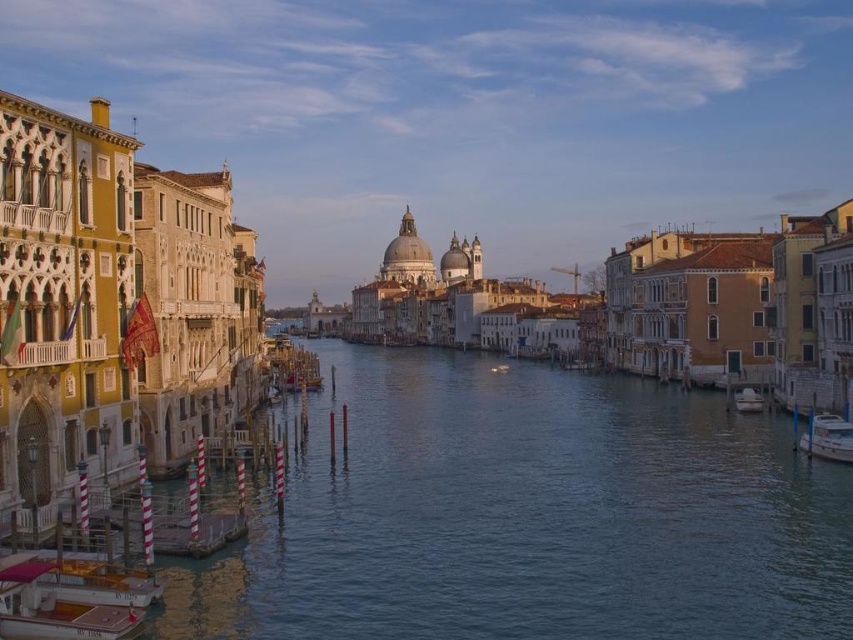
Question: Is wooden polished boat at lower left above white glossy boat at right?

Choices:
 (A) no
 (B) yes

Answer: (A)

Question: Which of the following is the closest to the observer?

Choices:
 (A) (821, 417)
 (B) (36, 637)

Answer: (B)

Question: Where is wooden polished boat at lower left located in relation to white glossy boat at lower right in the image?

Choices:
 (A) right
 (B) left

Answer: (B)

Question: Among these objects, which one is nearest to the camera?

Choices:
 (A) wooden polished boat at lower left
 (B) white glossy boat at lower right

Answer: (A)

Question: Which point is closer to the camera taking this photo?

Choices:
 (A) [738, 404]
 (B) [851, 456]

Answer: (B)

Question: Is wooden polished boat at lower left below white glossy boat at lower right?

Choices:
 (A) yes
 (B) no

Answer: (A)